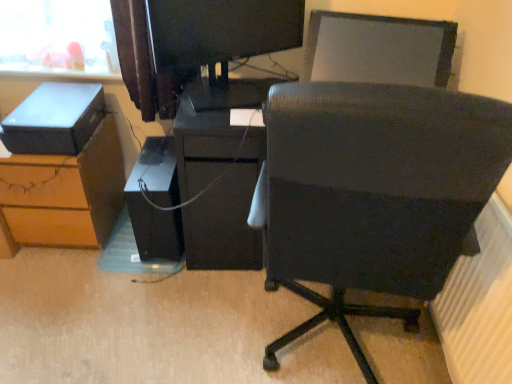
Question: Is matte black desk at center turned away from white textured radiator at lower right?

Choices:
 (A) no
 (B) yes

Answer: (A)

Question: From a real-world perspective, is matte black desk at center on top of white textured radiator at lower right?

Choices:
 (A) no
 (B) yes

Answer: (B)

Question: Could you tell me if matte black desk at center is facing white textured radiator at lower right?

Choices:
 (A) yes
 (B) no

Answer: (B)

Question: Does matte black desk at center have a greater width compared to white textured radiator at lower right?

Choices:
 (A) no
 (B) yes

Answer: (B)

Question: Does matte black desk at center have a lesser width compared to white textured radiator at lower right?

Choices:
 (A) yes
 (B) no

Answer: (B)

Question: Can you confirm if matte black desk at center is positioned to the left of white textured radiator at lower right?

Choices:
 (A) yes
 (B) no

Answer: (A)

Question: Is matte black storage box at left thinner than black matte computer tower at center?

Choices:
 (A) yes
 (B) no

Answer: (A)

Question: Can you confirm if matte black storage box at left is taller than black matte computer tower at center?

Choices:
 (A) no
 (B) yes

Answer: (A)

Question: From the image's perspective, is matte black storage box at left below black matte computer tower at center?

Choices:
 (A) yes
 (B) no

Answer: (B)

Question: Is matte black storage box at left shorter than black matte computer tower at center?

Choices:
 (A) no
 (B) yes

Answer: (B)

Question: Could you tell me if matte black storage box at left is turned towards black matte computer tower at center?

Choices:
 (A) no
 (B) yes

Answer: (A)

Question: Considering the relative sizes of matte black storage box at left and black matte computer tower at center in the image provided, is matte black storage box at left bigger than black matte computer tower at center?

Choices:
 (A) yes
 (B) no

Answer: (B)

Question: Is white textured radiator at lower right thinner than matte black desk at center?

Choices:
 (A) yes
 (B) no

Answer: (A)